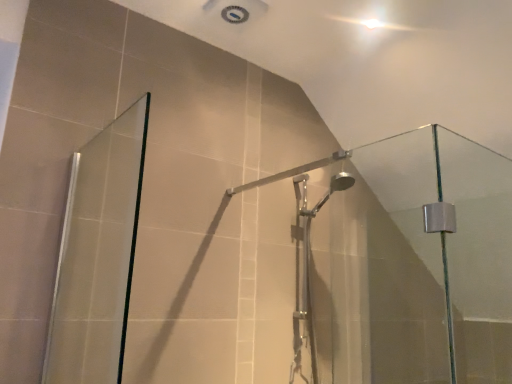
Locate an element on the screen. The height and width of the screenshot is (384, 512). transparent glass shower door at left is located at coordinates (98, 254).

What do you see at coordinates (98, 254) in the screenshot? This screenshot has width=512, height=384. I see `transparent glass shower door at left` at bounding box center [98, 254].

Where is `transparent glass shower door at left`? transparent glass shower door at left is located at coordinates (98, 254).